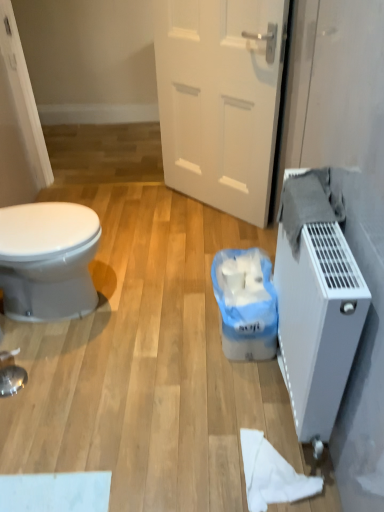
This screenshot has width=384, height=512. Find the location of `vacant space that is in between white plastic bag at lower center and white plastic radiator at right`. vacant space that is in between white plastic bag at lower center and white plastic radiator at right is located at coordinates (249, 390).